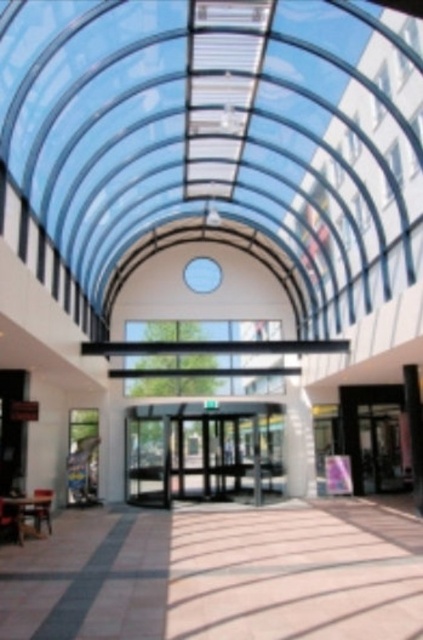
You are a visitor entering the atrium and want to exit through the transparent glass doors at center. There is a smooth white pillar at right nearby. Which object is closer to you in terms of size?

The transparent glass doors at center is smaller than the smooth white pillar at right, so the transparent glass doors at center is closer in size to you.